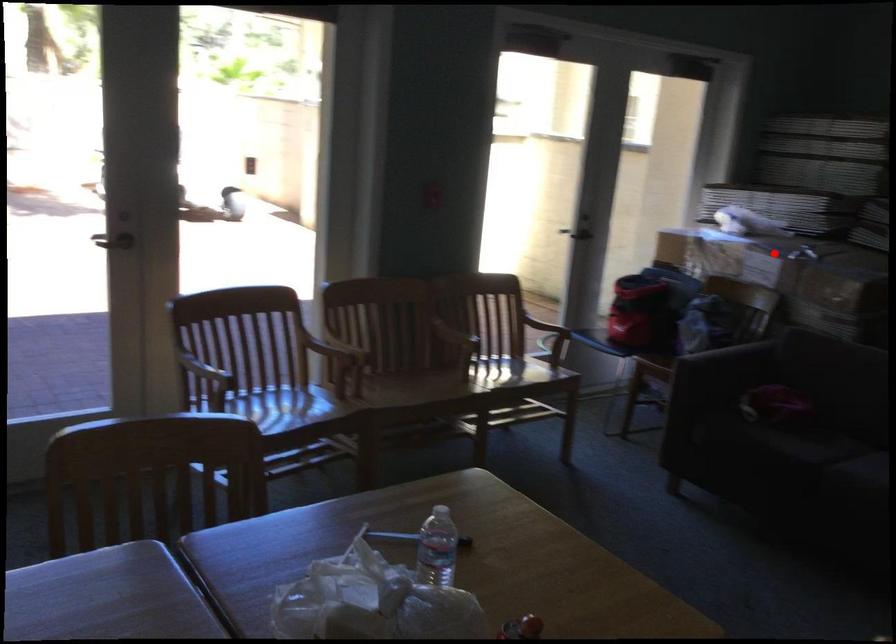
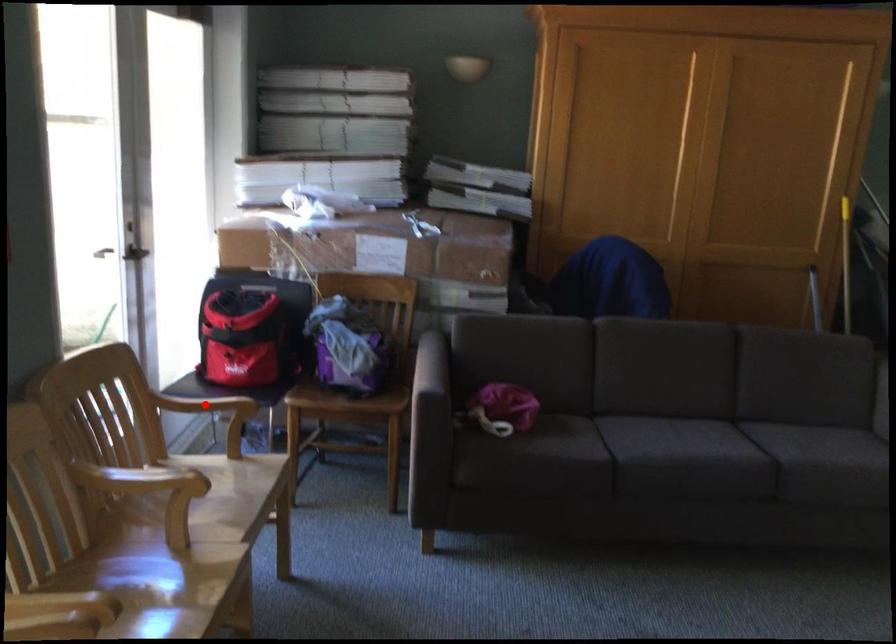
In the scene shown: I am providing you with two images of the same scene from different viewpoints. A red point is marked on the first image and another point is marked on the second image. Is the marked point in image1 the same physical position as the marked point in image2?

No